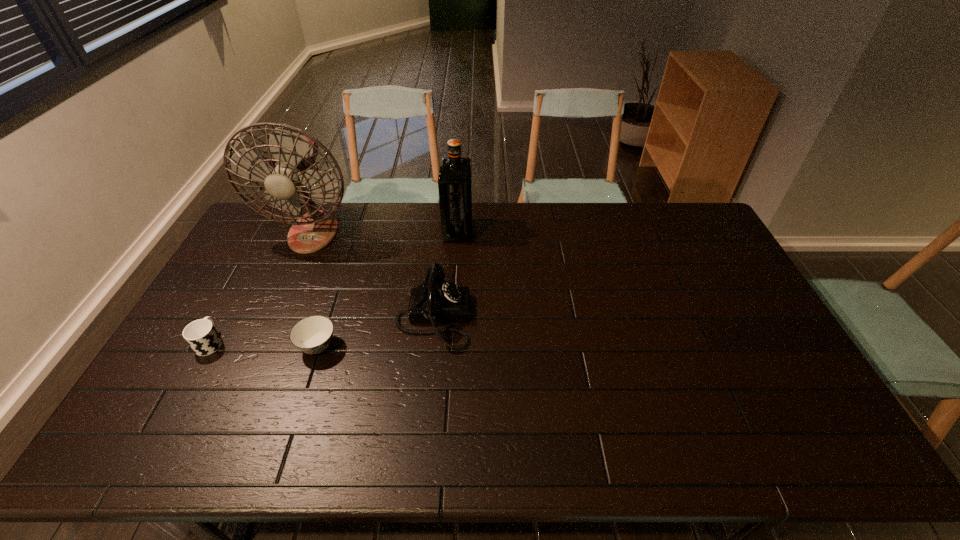
Where is `fan`? This screenshot has width=960, height=540. fan is located at coordinates (294, 151).

Where is `liquor`? liquor is located at coordinates (455, 173).

Where is `telephone`? The height and width of the screenshot is (540, 960). telephone is located at coordinates (436, 300).

Find the location of a particular element. This screenshot has width=960, height=540. cup is located at coordinates (201, 335).

This screenshot has height=540, width=960. What are the coordinates of `the shortest object` in the screenshot? It's located at (312, 335).

You are a GUI agent. You are given a task and a screenshot of the screen. Output one action in this format:
    pyautogui.click(x=<x>, y=<y>)
    Task: Click on the vacant space located in front of the fan to direct airflow
    
    Given the screenshot: What is the action you would take?
    pyautogui.click(x=263, y=348)

Find the location of a particular element. vacant region located on the front label of the liquor is located at coordinates (494, 231).

Locate an element on the screen. The width and height of the screenshot is (960, 540). free space located on the dial of the telephone is located at coordinates (523, 317).

What are the coordinates of `vacant region located 0.180m on the side of the cup with the handle` in the screenshot? It's located at (242, 286).

What are the coordinates of `blank area located on the side of the cup with the handle` in the screenshot? It's located at (225, 316).